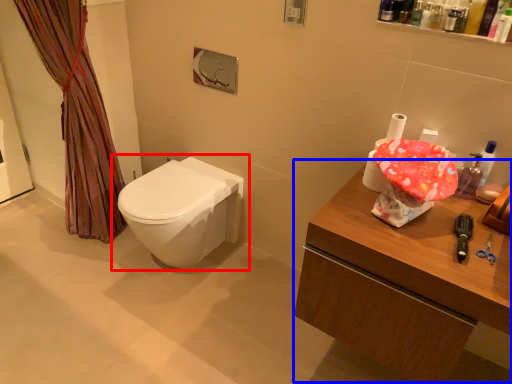
Question: Which of the following is the closest to the observer, toilet (highlighted by a red box) or counter (highlighted by a blue box)?

Choices:
 (A) toilet
 (B) counter

Answer: (B)